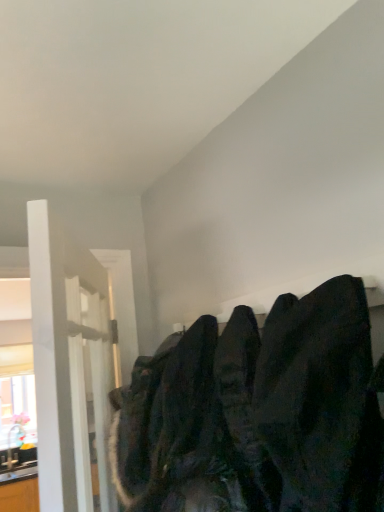
Question: Which is correct: dark fabric coat at upper right is inside white glossy door at left, or outside of it?

Choices:
 (A) outside
 (B) inside

Answer: (A)

Question: In the image, is dark fabric coat at upper right positioned in front of or behind white glossy door at left?

Choices:
 (A) behind
 (B) front

Answer: (B)

Question: Estimate the real-world distances between objects in this image. Which object is closer to the matte white window at left?

Choices:
 (A) white glossy door at left
 (B) dark fabric coat at upper right
 (C) dark matte sweatshirt at upper right

Answer: (A)

Question: Which is nearer to the white glossy door at left?

Choices:
 (A) dark matte sweatshirt at upper right
 (B) dark fabric coat at upper right
 (C) matte white window at left

Answer: (A)